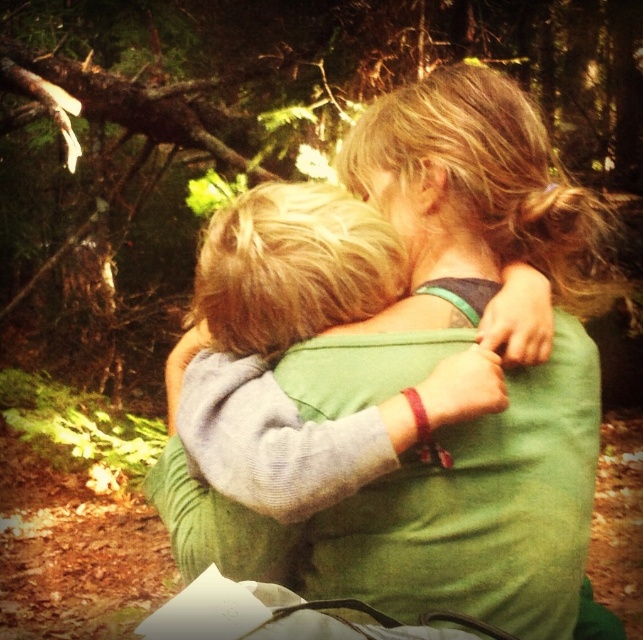
Question: In this image, where is green fabric at center located relative to green soft sweater at center?

Choices:
 (A) left
 (B) right

Answer: (B)

Question: Which is farther from the green fabric at center?

Choices:
 (A) light gray fleece sweater at center
 (B) green soft sweater at center

Answer: (B)

Question: Can you confirm if green fabric at center is positioned to the left of light gray fleece sweater at center?

Choices:
 (A) no
 (B) yes

Answer: (A)

Question: Which of the following is the closest to the observer?

Choices:
 (A) (199, 67)
 (B) (266, 262)
 (C) (530, 576)

Answer: (B)

Question: In this image, where is green fabric at center located relative to green soft sweater at center?

Choices:
 (A) right
 (B) left

Answer: (A)

Question: Based on their relative distances, which object is nearer to the light gray fleece sweater at center?

Choices:
 (A) green fabric at center
 (B) green soft sweater at center

Answer: (B)